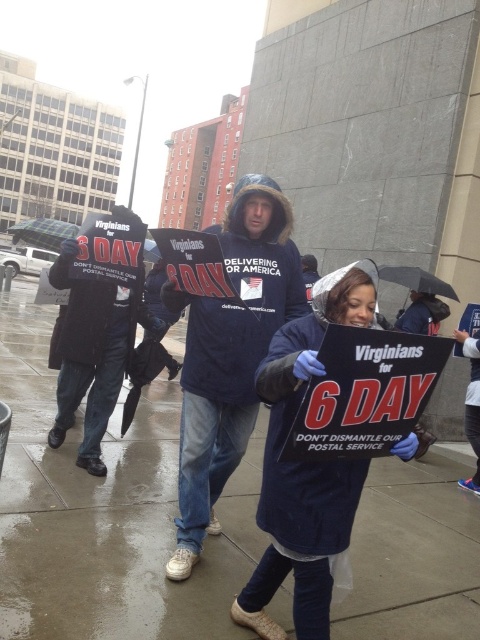
Question: Which of the following is the closest to the observer?

Choices:
 (A) (55, 236)
 (B) (92, 456)
 (C) (278, 570)

Answer: (C)

Question: Does dark blue fleece jacket at center have a greater width compared to black matte jacket at left?

Choices:
 (A) no
 (B) yes

Answer: (A)

Question: Is blue fabric pants at lower right below transparent plastic umbrella at center?

Choices:
 (A) no
 (B) yes

Answer: (B)

Question: Which point appears farthest from the camera in this image?

Choices:
 (A) (269, 236)
 (B) (46, 236)
 (C) (387, 276)
 (D) (479, 364)

Answer: (C)

Question: Can you confirm if black matte jacket at left is positioned below blue fabric pants at lower right?

Choices:
 (A) yes
 (B) no

Answer: (B)

Question: Which point is farther to the camera?

Choices:
 (A) (409, 284)
 (B) (266, 333)

Answer: (A)